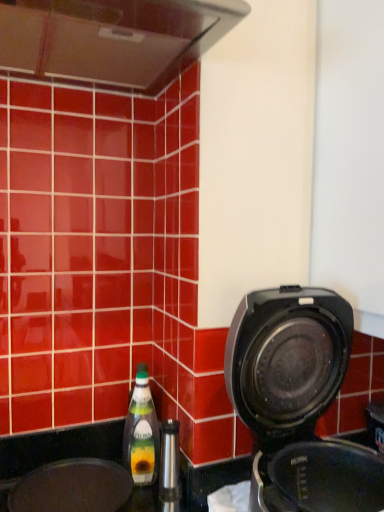
Question: Would you say black matte sink at lower left is to the left or to the right of green glass bottle at lower left in the picture?

Choices:
 (A) right
 (B) left

Answer: (B)

Question: From a real-world perspective, is black matte sink at lower left positioned above or below green glass bottle at lower left?

Choices:
 (A) above
 (B) below

Answer: (B)

Question: Which of these objects is positioned farthest from the green glass bottle at lower left?

Choices:
 (A) black matte sink at lower left
 (B) black plastic coffee maker at right

Answer: (B)

Question: Which object is the farthest from the green glass bottle at lower left?

Choices:
 (A) black plastic coffee maker at right
 (B) black matte sink at lower left

Answer: (A)